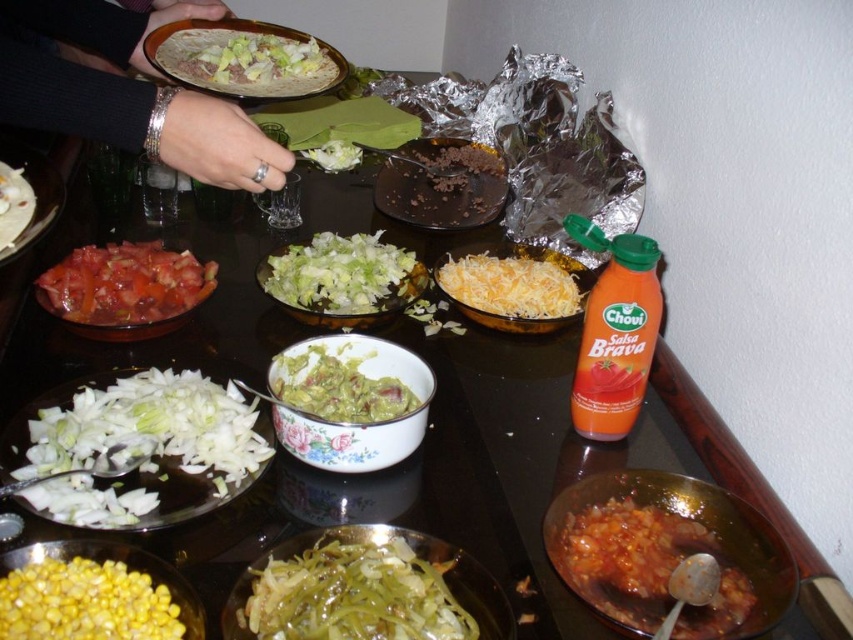
Question: Which object appears farthest from the camera in this image?

Choices:
 (A) white shredded object at center
 (B) green translucent onions at center
 (C) green guacamole at center
 (D) white shredded lettuce at center

Answer: (D)

Question: Is tomato paste at lower left to the left of white shredded lettuce at center from the viewer's perspective?

Choices:
 (A) yes
 (B) no

Answer: (A)

Question: Which point is farther to the camera?

Choices:
 (A) shiny silver taco at upper center
 (B) white chopped onions at lower left

Answer: (A)

Question: From the image, what is the correct spatial relationship of silver metallic bracelet at upper left in relation to yellow matte corn at lower left?

Choices:
 (A) below
 (B) above

Answer: (B)

Question: Which of the following is the closest to the observer?

Choices:
 (A) (248, 60)
 (B) (624, 561)

Answer: (B)

Question: Is tomato paste at lower left positioned behind shiny silver taco at upper center?

Choices:
 (A) no
 (B) yes

Answer: (A)